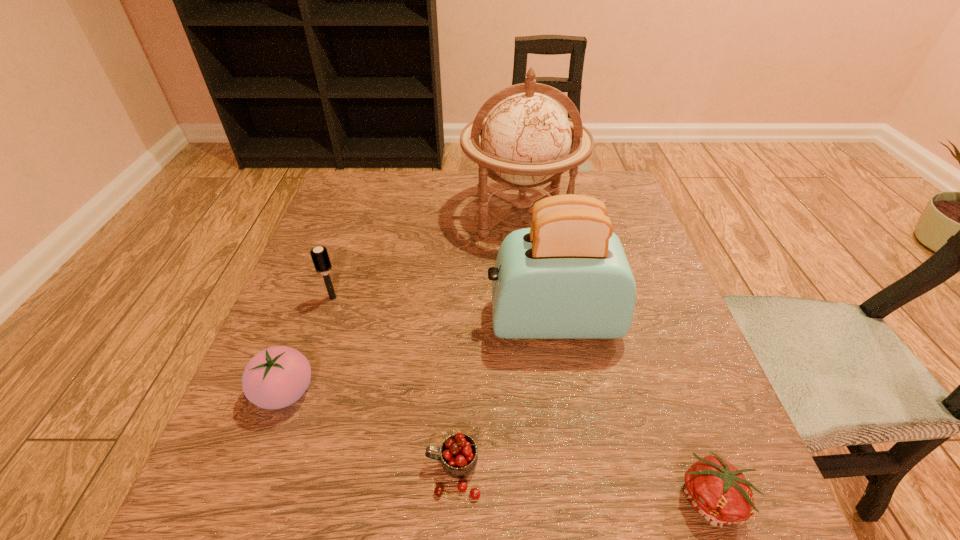
This screenshot has height=540, width=960. In order to click on vacant region located 0.220m on the side of the toaster with the lever in this screenshot , I will do `click(378, 321)`.

Identify the location of vacant space situated 0.340m on the side of the toaster with the lever. The width and height of the screenshot is (960, 540). (319, 321).

This screenshot has width=960, height=540. Identify the location of vacant space positioned on the side of the toaster with the lever. (397, 321).

Locate an element on the screen. This screenshot has width=960, height=540. free point located 0.130m on the front of the hairbrush is located at coordinates (314, 353).

Find the location of `vacant area situated 0.050m on the right of the third nearest object`. vacant area situated 0.050m on the right of the third nearest object is located at coordinates (345, 392).

The image size is (960, 540). I want to click on free space located 0.260m on the handle side of the cherry, so click(x=254, y=472).

You are a GUI agent. You are given a task and a screenshot of the screen. Output one action in this format:
    pyautogui.click(x=<x>, y=<y>)
    Task: Click on the vacant area situated 0.160m on the handle side of the cherry
    This screenshot has height=540, width=960.
    Given the screenshot: What is the action you would take?
    pyautogui.click(x=321, y=472)

Find the location of a particular element. The width and height of the screenshot is (960, 540). blank area located on the handle side of the cherry is located at coordinates (221, 472).

This screenshot has width=960, height=540. I want to click on free spot located 0.160m on the left of the nearer tomato, so click(x=567, y=499).

Identify the location of object present at the far edge. The image size is (960, 540). (526, 139).